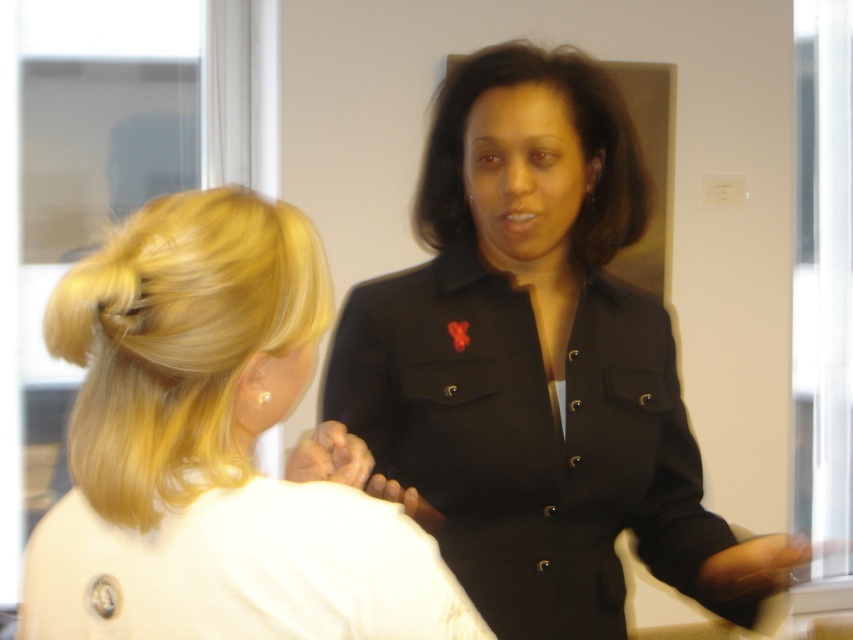
Is matte black blazer at upper right positioned at the back of black smooth hair at center?

No, matte black blazer at upper right is in front of black smooth hair at center.

Can you confirm if matte black blazer at upper right is positioned to the left of black smooth hair at center?

Yes, matte black blazer at upper right is to the left of black smooth hair at center.

Which is behind, point (392, 556) or point (592, 140)?

The point (592, 140) is behind.

This screenshot has height=640, width=853. I want to click on matte black blazer at upper right, so click(x=215, y=449).

Is black matte jacket at center smaller than matte black blazer at upper right?

Incorrect, black matte jacket at center is not smaller in size than matte black blazer at upper right.

Can you confirm if black matte jacket at center is positioned to the right of matte black blazer at upper right?

Indeed, black matte jacket at center is positioned on the right side of matte black blazer at upper right.

Does point (368, 381) lie behind point (144, 400)?

Yes, point (368, 381) is behind point (144, 400).

Find the location of `black matte jacket at center`. black matte jacket at center is located at coordinates (537, 365).

Can you confirm if matte black blazer at upper right is smaller than blonde silky hair at left?

Actually, matte black blazer at upper right might be larger than blonde silky hair at left.

Is point (247, 596) farther from camera compared to point (164, 216)?

No, it is not.

This screenshot has width=853, height=640. Find the location of `matte black blazer at upper right`. matte black blazer at upper right is located at coordinates (215, 449).